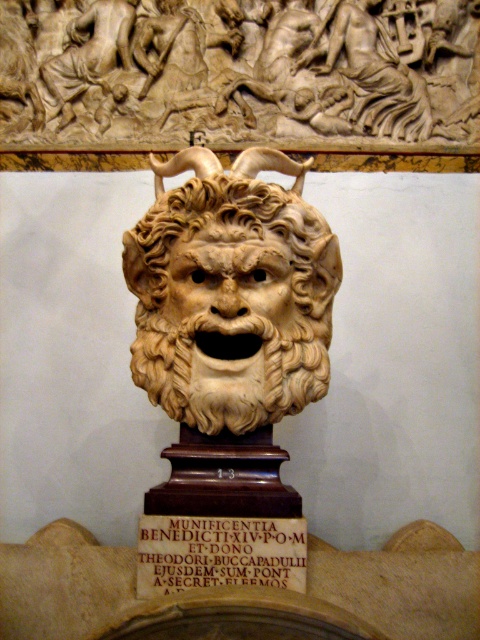
How distant is carved ivory lion head at center from carved stone plaque at center?

carved ivory lion head at center is 2.29 meters away from carved stone plaque at center.

Which is in front, point (172, 292) or point (267, 529)?

Positioned in front is point (267, 529).

Image resolution: width=480 pixels, height=640 pixels. Identify the location of carved ivory lion head at center. (230, 310).

What are the coordinates of `carved ivory lion head at center` in the screenshot? It's located at (230, 310).

Is beige marble lion at center taller than carved ivory lion head at center?

Indeed, beige marble lion at center has a greater height compared to carved ivory lion head at center.

Who is more distant from viewer, (167, 221) or (250, 284)?

Positioned behind is point (167, 221).

Where is `beige marble lion at center`? The height and width of the screenshot is (640, 480). beige marble lion at center is located at coordinates [x=230, y=292].

Does beige marble lion at center have a greater height compared to carved stone plaque at center?

Yes.

Between beige marble lion at center and carved stone plaque at center, which one has more height?

With more height is beige marble lion at center.

I want to click on beige marble lion at center, so click(230, 292).

Identify the location of beige marble lion at center. (230, 292).